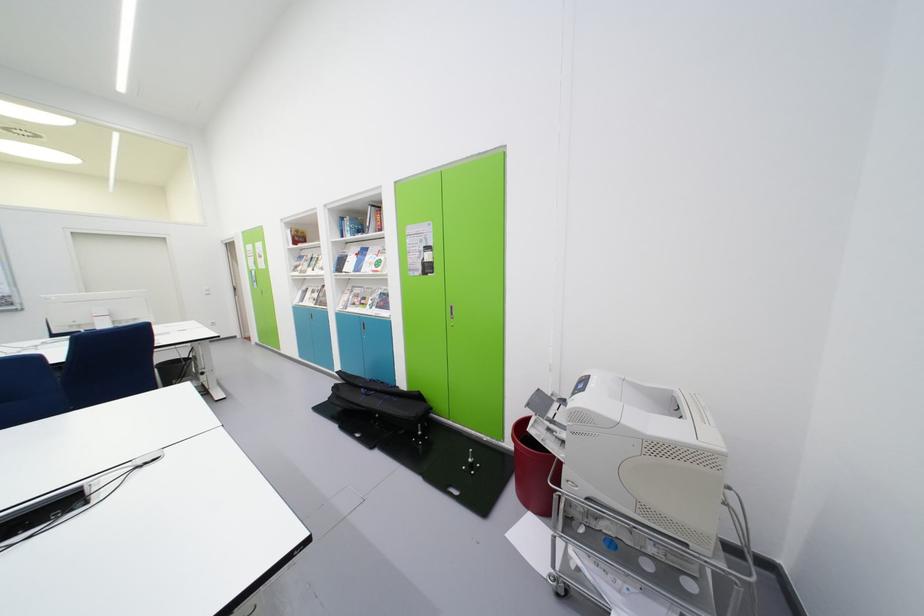
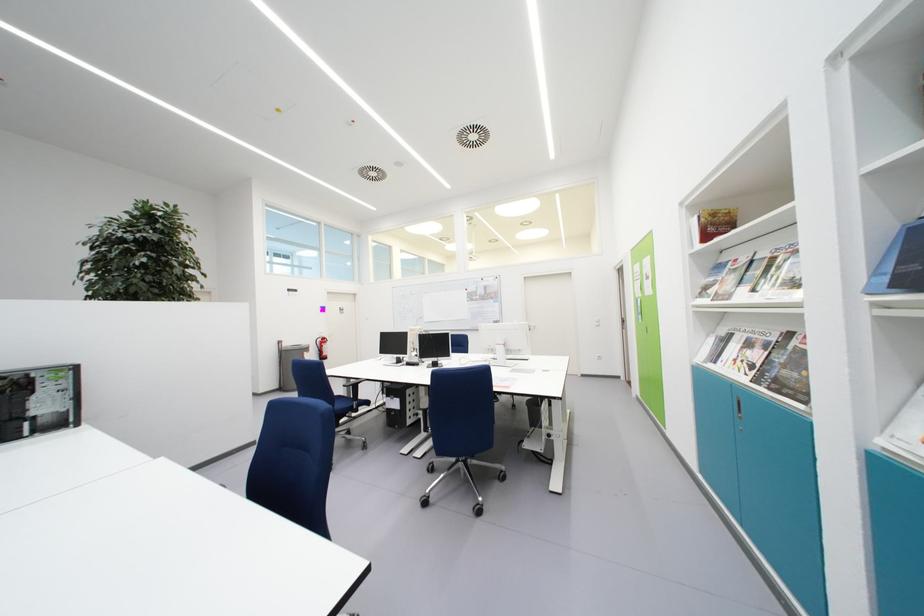
Where in the second image is the point corresponding to point 304,235 from the first image?

(720, 217)